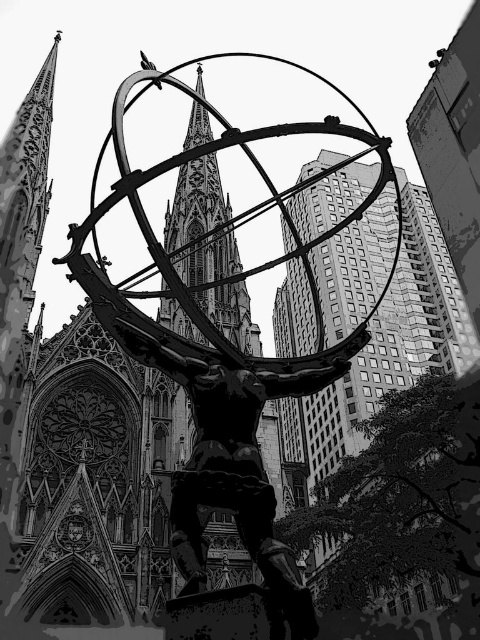
Question: Which point is farther to the camera?

Choices:
 (A) metallic statue at center
 (B) smooth stone spire at center

Answer: (B)

Question: Which point is farther to the camera?

Choices:
 (A) (173, 308)
 (B) (271, 380)

Answer: (A)

Question: Does metallic statue at center appear over smooth stone spire at center?

Choices:
 (A) no
 (B) yes

Answer: (A)

Question: Can you confirm if metallic statue at center is smaller than smooth stone spire at center?

Choices:
 (A) no
 (B) yes

Answer: (A)

Question: Does metallic statue at center appear over smooth stone spire at center?

Choices:
 (A) no
 (B) yes

Answer: (A)

Question: Which point is farther to the camera?

Choices:
 (A) (189, 353)
 (B) (235, 289)

Answer: (B)